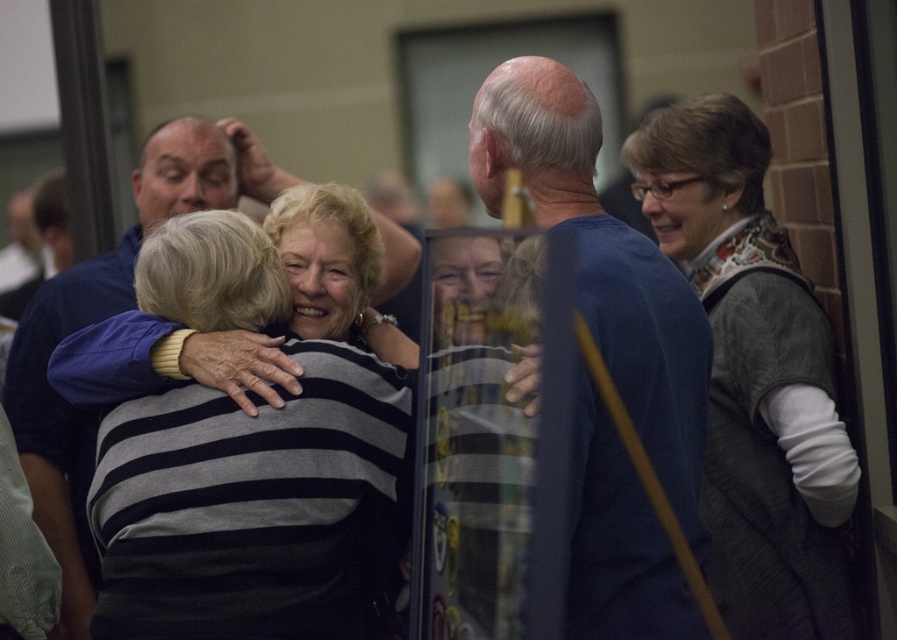
Is striped fabric sweater at center closer to camera compared to blue fabric shirt at center?

No, it is not.

Can you confirm if striped fabric sweater at center is positioned above blue fabric shirt at center?

No, striped fabric sweater at center is not above blue fabric shirt at center.

Is point (356, 506) positioned after point (479, 129)?

Yes.

This screenshot has width=897, height=640. Identify the location of striped fabric sweater at center. (258, 467).

Is knitted gray vest at right above blue fabric shirt at center?

Incorrect, knitted gray vest at right is not positioned above blue fabric shirt at center.

Does knitted gray vest at right have a smaller size compared to blue fabric shirt at center?

Correct, knitted gray vest at right occupies less space than blue fabric shirt at center.

The height and width of the screenshot is (640, 897). What are the coordinates of `knitted gray vest at right` in the screenshot? It's located at (753, 374).

Does striped fabric sweater at center appear on the left side of knitted gray vest at right?

Indeed, striped fabric sweater at center is positioned on the left side of knitted gray vest at right.

Does striped fabric sweater at center lie behind knitted gray vest at right?

That is False.

Between point (255, 556) and point (739, 208), which one is positioned behind?

The point (739, 208) is behind.

Locate an element on the screen. Image resolution: width=897 pixels, height=640 pixels. striped fabric sweater at center is located at coordinates (258, 467).